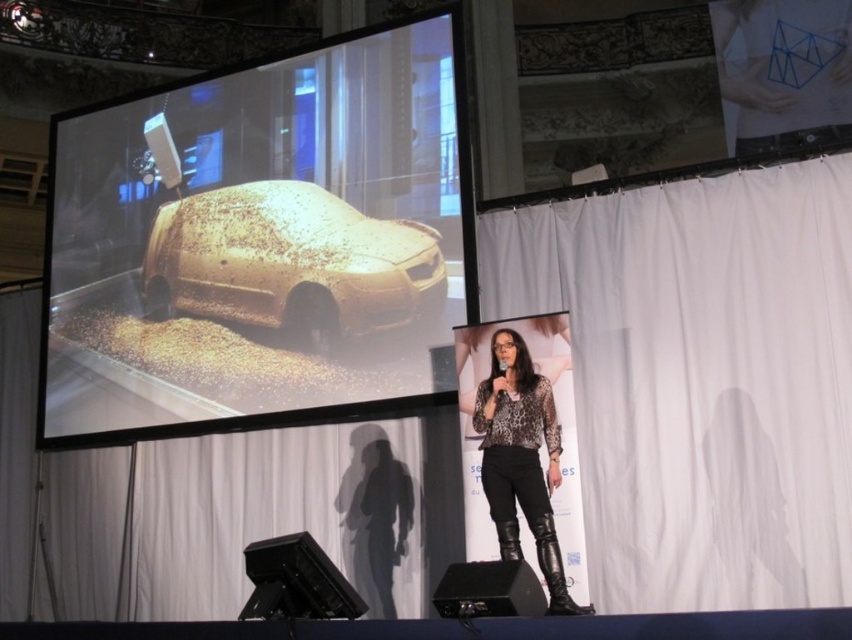
Question: Can you confirm if gold glitter car at upper left is wider than gold textured car at center?

Choices:
 (A) no
 (B) yes

Answer: (B)

Question: Is gold glitter car at upper left positioned behind white matte curtain at upper center?

Choices:
 (A) no
 (B) yes

Answer: (B)

Question: Which object appears farthest from the camera in this image?

Choices:
 (A) leopard print blouse at center
 (B) gold glitter car at upper left

Answer: (B)

Question: Among these objects, which one is farthest from the camera?

Choices:
 (A) gold textured car at center
 (B) gold glitter car at upper left

Answer: (A)

Question: Which object is farther from the camera taking this photo?

Choices:
 (A) white matte curtain at upper center
 (B) gold textured car at center
 (C) white matte curtain at center
 (D) gold glitter car at upper left

Answer: (B)

Question: Does gold glitter car at upper left appear on the right side of white matte curtain at upper center?

Choices:
 (A) yes
 (B) no

Answer: (A)